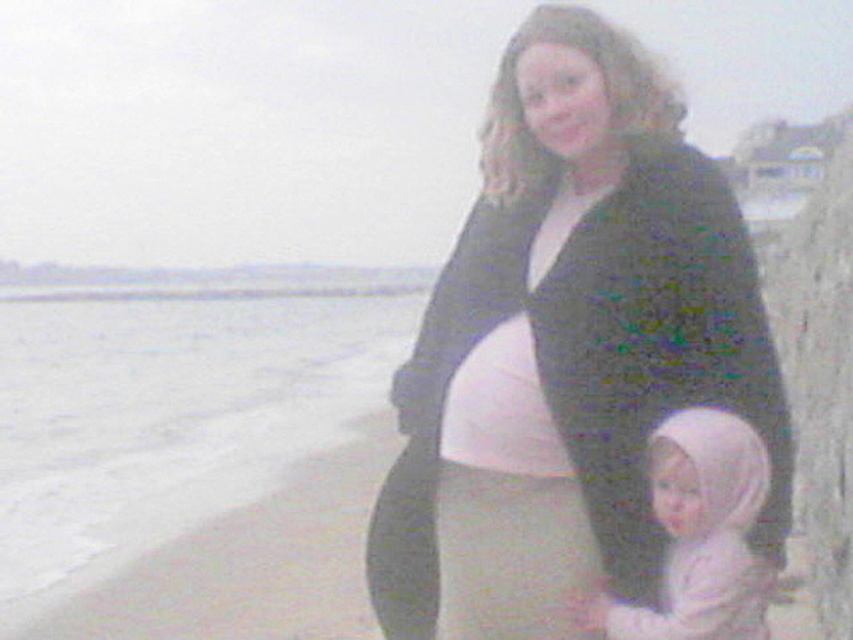
Can you confirm if pink fabric baby at lower center is positioned below matte white belly at center?

Yes, pink fabric baby at lower center is below matte white belly at center.

Can you confirm if pink fabric baby at lower center is shorter than matte white belly at center?

No.

Does point (769, 472) come closer to viewer compared to point (537, 420)?

Yes, it is in front of point (537, 420).

Find the location of a particular element. pink fabric baby at lower center is located at coordinates (699, 534).

Is matte black sweater at center shorter than matte white belly at center?

Incorrect, matte black sweater at center's height does not fall short of matte white belly at center's.

Is point (502, 220) farther from viewer compared to point (509, 378)?

Yes, point (502, 220) is behind point (509, 378).

Identify the location of matte black sweater at center. The image size is (853, 640). (570, 353).

Is point (788, 483) less distant than point (712, 538)?

No, (788, 483) is further to viewer.

The image size is (853, 640). I want to click on matte black sweater at center, so click(570, 353).

This screenshot has height=640, width=853. Identify the location of matte black sweater at center. (570, 353).